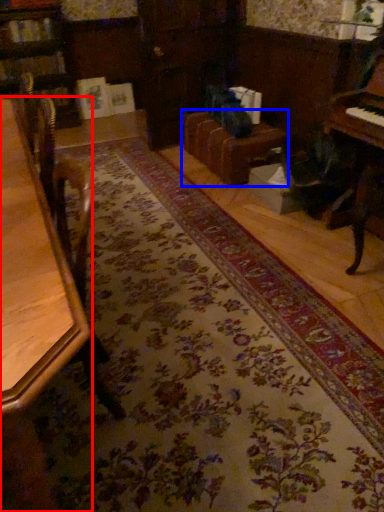
Question: Which object appears closest to the camera in this image, table (highlighted by a red box) or couch (highlighted by a blue box)?

Choices:
 (A) table
 (B) couch

Answer: (A)